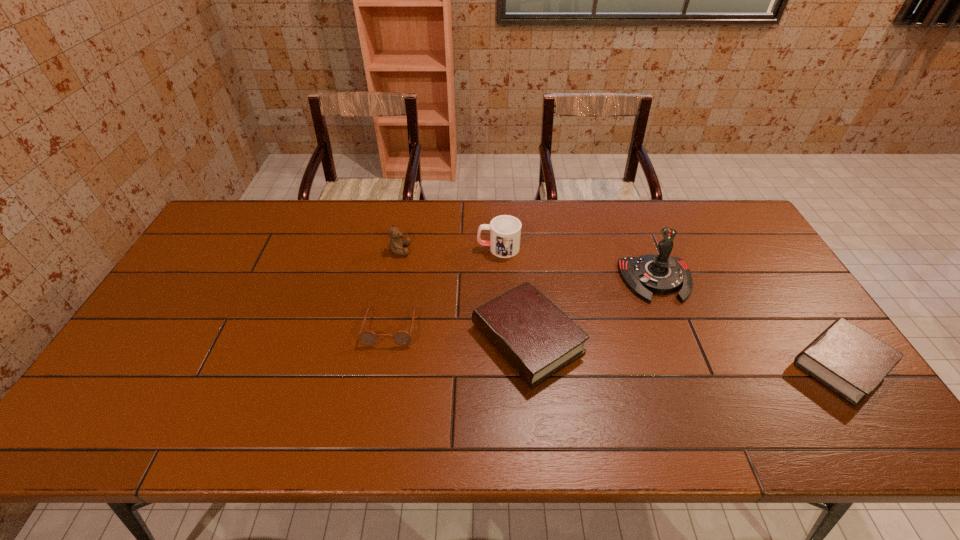
Please point a spot on the left to add another Bible. Please provide its 2D coordinates. Your answer should be formatted as a tuple, i.e. [(x, y)], where the tuple contains the x and y coordinates of a point satisfying the conditions above.

[(242, 316)]